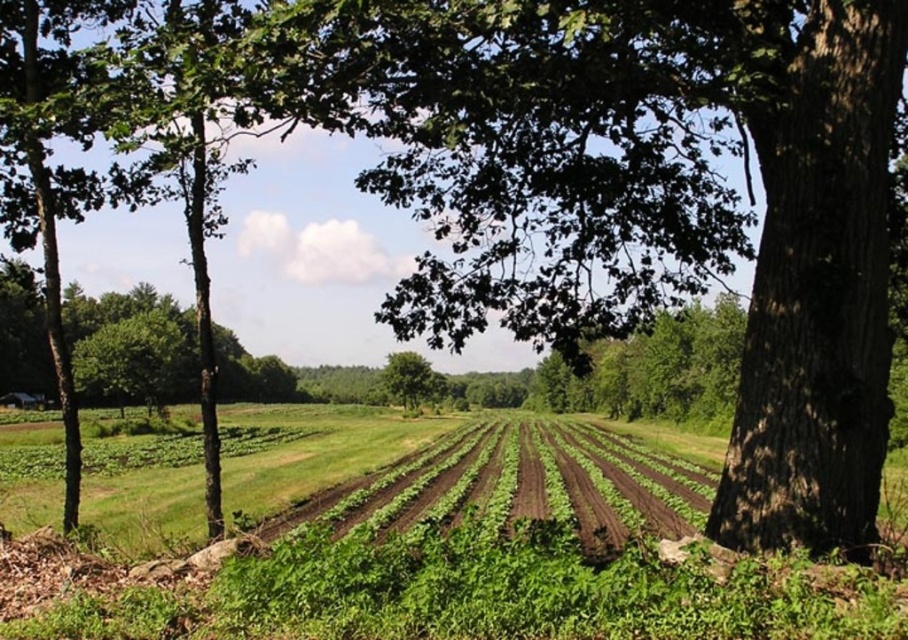
Does point (272, 618) lie in front of point (517, 420)?

That is True.

Does green leafy grass at center have a lesser width compared to green leafy plants at center?

Yes, green leafy grass at center is thinner than green leafy plants at center.

Is point (421, 468) in front of point (568, 490)?

No, (421, 468) is behind (568, 490).

Locate an element on the screen. The image size is (908, 640). green leafy grass at center is located at coordinates (471, 561).

Who is positioned more to the right, green leafy plants at center or green leafy tree at center?

green leafy plants at center is more to the right.

What do you see at coordinates (527, 484) in the screenshot?
I see `green leafy plants at center` at bounding box center [527, 484].

Locate an element on the screen. green leafy plants at center is located at coordinates (527, 484).

Between point (906, 634) and point (432, 381), which one is positioned in front?

Point (906, 634)

Who is more distant from viewer, (3,570) or (386,360)?

The point (386,360) is more distant.

Measure the distance between point (698, 572) and camera.

The distance of point (698, 572) from camera is 19.20 feet.

Where is `green leafy grass at center`? This screenshot has height=640, width=908. green leafy grass at center is located at coordinates (471, 561).